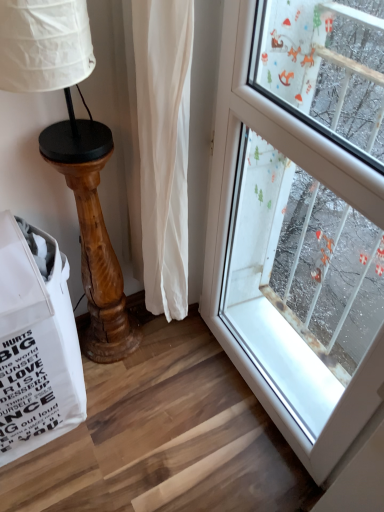
Describe the element at coordinates (36, 345) in the screenshot. I see `white fabric grocery bag at lower left` at that location.

Locate an element on the screen. The image size is (384, 512). white fabric grocery bag at lower left is located at coordinates coord(36,345).

This screenshot has height=512, width=384. I want to click on wooden table lamp at left, so click(72, 152).

Image resolution: width=384 pixels, height=512 pixels. What do you see at coordinates (72, 152) in the screenshot?
I see `wooden table lamp at left` at bounding box center [72, 152].

Locate an element on the screen. The width and height of the screenshot is (384, 512). white fabric grocery bag at lower left is located at coordinates (36, 345).

Can you confirm if wooden table lamp at left is positioned to the left of white fabric grocery bag at lower left?

No.

Considering the positions of objects wooden table lamp at left and white fabric grocery bag at lower left in the image provided, who is in front, wooden table lamp at left or white fabric grocery bag at lower left?

white fabric grocery bag at lower left is in front.

Which is nearer, (58,50) or (49,406)?

Point (58,50) appears to be closer to the viewer than point (49,406).

From the image's perspective, is wooden table lamp at left beneath white fabric grocery bag at lower left?

No.

From the picture: From a real-world perspective, is wooden table lamp at left under white fabric grocery bag at lower left?

No.

In the scene shown: Is wooden table lamp at left thinner than white fabric grocery bag at lower left?

Yes.

Can you confirm if wooden table lamp at left is taller than white fabric grocery bag at lower left?

Indeed, wooden table lamp at left has a greater height compared to white fabric grocery bag at lower left.

Looking at this image, considering the sizes of objects wooden table lamp at left and white fabric grocery bag at lower left in the image provided, who is bigger, wooden table lamp at left or white fabric grocery bag at lower left?

With larger size is white fabric grocery bag at lower left.

Is wooden table lamp at left outside of white fabric grocery bag at lower left?

wooden table lamp at left lies outside white fabric grocery bag at lower left's area.

Is wooden table lamp at left not close to white fabric grocery bag at lower left?

No, wooden table lamp at left is not far from white fabric grocery bag at lower left.

Is wooden table lamp at left positioned with its back to white fabric grocery bag at lower left?

wooden table lamp at left is not turned away from white fabric grocery bag at lower left.

How many degrees apart are the facing directions of wooden table lamp at left and white fabric grocery bag at lower left?

There is a 0.000565-degree angle between the facing directions of wooden table lamp at left and white fabric grocery bag at lower left.

Find the location of a particular element. The height and width of the screenshot is (512, 384). grocery bag lying on the left of wooden table lamp at left is located at coordinates (36, 345).

Is white fabric grocery bag at lower left to the left or to the right of wooden table lamp at left in the image?

In the image, white fabric grocery bag at lower left appears on the left side of wooden table lamp at left.

Which is behind, white fabric grocery bag at lower left or wooden table lamp at left?

Positioned behind is wooden table lamp at left.

Does point (80, 387) appear closer or farther from the camera than point (128, 335)?

Point (80, 387).

From the image's perspective, is white fabric grocery bag at lower left above wooden table lamp at left?

Incorrect, from the image's perspective, white fabric grocery bag at lower left is lower than wooden table lamp at left.

From a real-world perspective, who is located higher, white fabric grocery bag at lower left or wooden table lamp at left?

wooden table lamp at left.

Considering the sizes of white fabric grocery bag at lower left and wooden table lamp at left in the image, is white fabric grocery bag at lower left wider or thinner than wooden table lamp at left?

Considering their sizes, white fabric grocery bag at lower left looks broader than wooden table lamp at left.

Considering the sizes of objects white fabric grocery bag at lower left and wooden table lamp at left in the image provided, who is taller, white fabric grocery bag at lower left or wooden table lamp at left?

wooden table lamp at left is taller.

Does white fabric grocery bag at lower left have a larger size compared to wooden table lamp at left?

Yes.

Would you say white fabric grocery bag at lower left contains wooden table lamp at left?

Actually, wooden table lamp at left is outside white fabric grocery bag at lower left.

Is white fabric grocery bag at lower left far away from wooden table lamp at left?

white fabric grocery bag at lower left is actually quite close to wooden table lamp at left.

Is white fabric grocery bag at lower left turned away from wooden table lamp at left?

No, white fabric grocery bag at lower left is not facing the opposite direction of wooden table lamp at left.

How different are the orientations of white fabric grocery bag at lower left and wooden table lamp at left in degrees?

0.000565 degrees separate the facing orientations of white fabric grocery bag at lower left and wooden table lamp at left.

Where is `table lamp behind the white fabric grocery bag at lower left`? table lamp behind the white fabric grocery bag at lower left is located at coordinates (72, 152).

This screenshot has height=512, width=384. What are the coordinates of `grocery bag in front of the wooden table lamp at left` in the screenshot? It's located at (36, 345).

The image size is (384, 512). What are the coordinates of `table lamp behind the white fabric grocery bag at lower left` in the screenshot? It's located at pos(72,152).